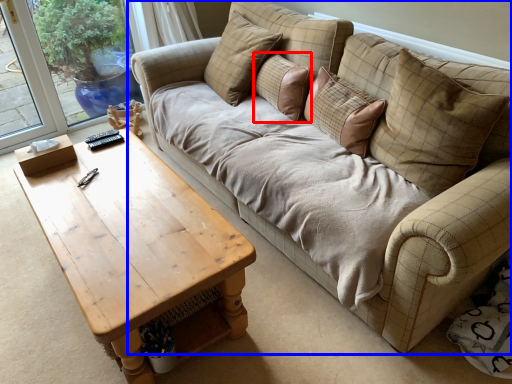
Question: Which object appears farthest to the camera in this image, pillow (highlighted by a red box) or studio couch (highlighted by a blue box)?

Choices:
 (A) pillow
 (B) studio couch

Answer: (A)